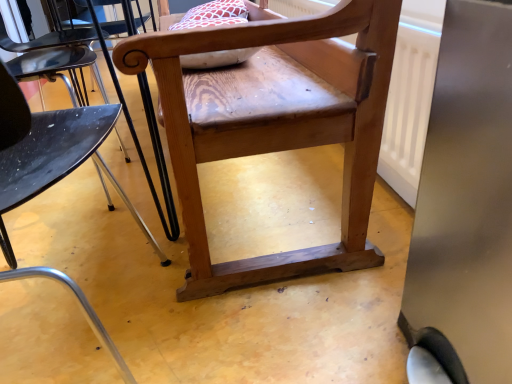
Find the location of `unoccupied space behind wooden chair at center, which appears as the 2th chair when viewed from the back`. unoccupied space behind wooden chair at center, which appears as the 2th chair when viewed from the back is located at coordinates (124, 230).